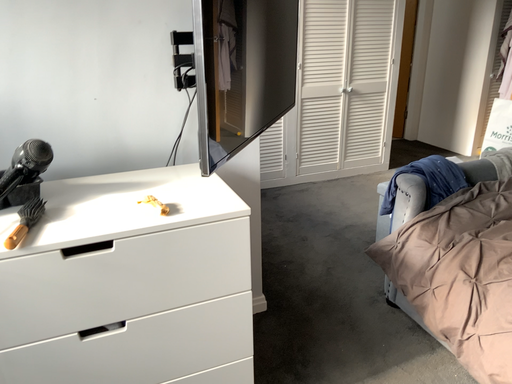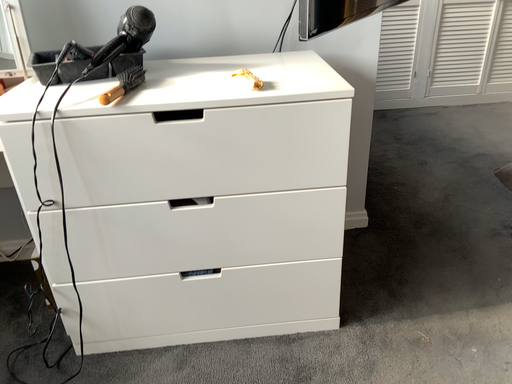
Question: How did the camera likely rotate when shooting the video?

Choices:
 (A) rotated left
 (B) rotated right

Answer: (A)